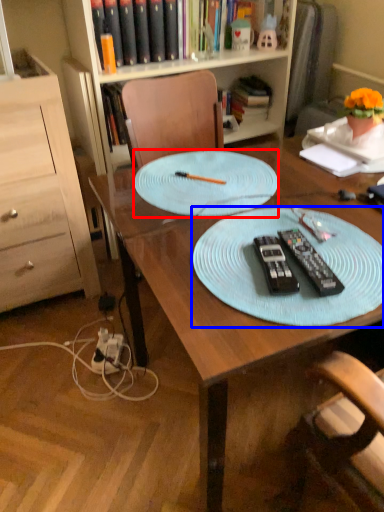
Question: Which point is closer to the camera, glass plate (highlighted by a red box) or platter (highlighted by a blue box)?

Choices:
 (A) glass plate
 (B) platter

Answer: (B)